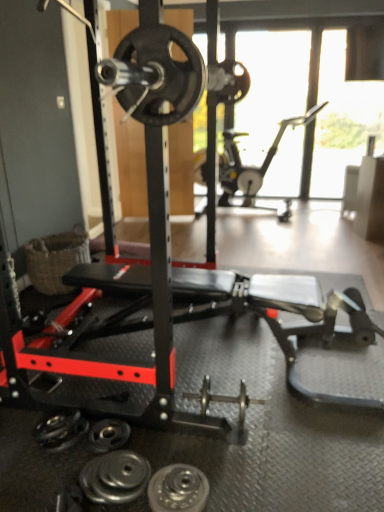
Image resolution: width=384 pixels, height=512 pixels. I want to click on free area in between silver metallic weight plate at lower center, the 1th wheel in the right-to-left sequence, and polished silver dumbbell at center, acting as the second dumbbell starting from the front, so click(218, 454).